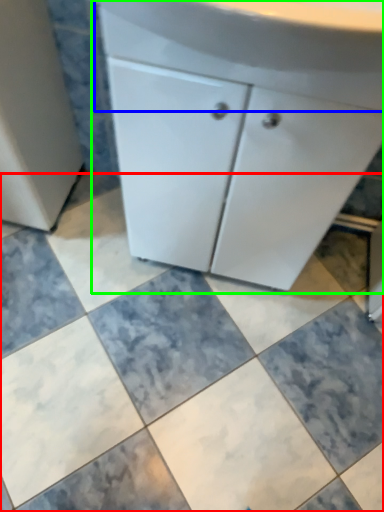
Question: Considering the real-world distances, which object is farthest from ceramic tile (highlighted by a red box)? counter top (highlighted by a blue box) or bathroom cabinet (highlighted by a green box)?

Choices:
 (A) counter top
 (B) bathroom cabinet

Answer: (A)